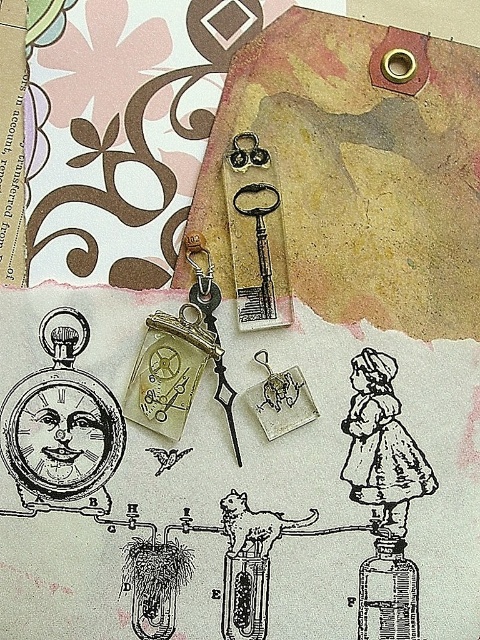
Looking at the collage artwork, you notice the silver metallic pocket watch at lower left and the matte glass bottle at center. Which object is placed higher up in the image?

The silver metallic pocket watch at lower left is positioned over the matte glass bottle at center, meaning it is placed higher up.